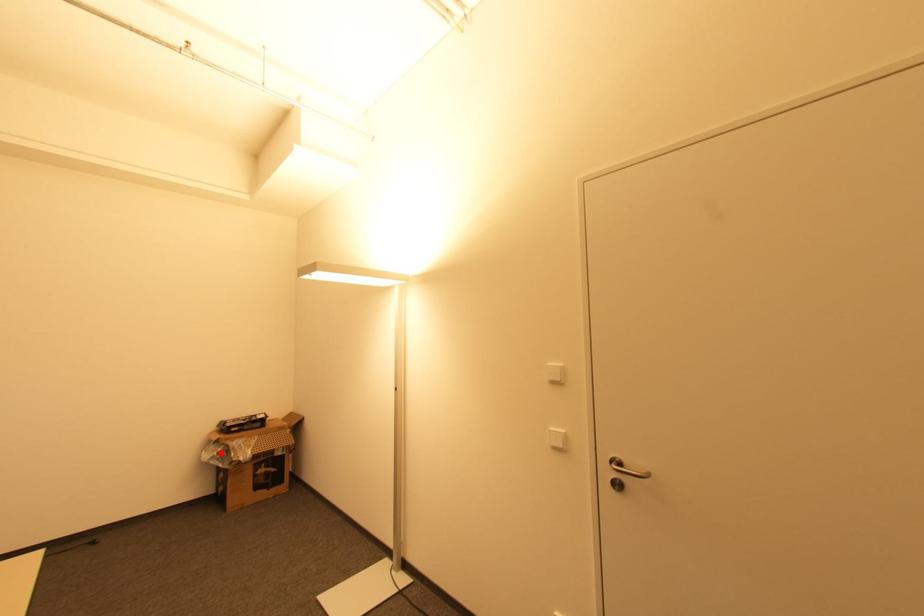
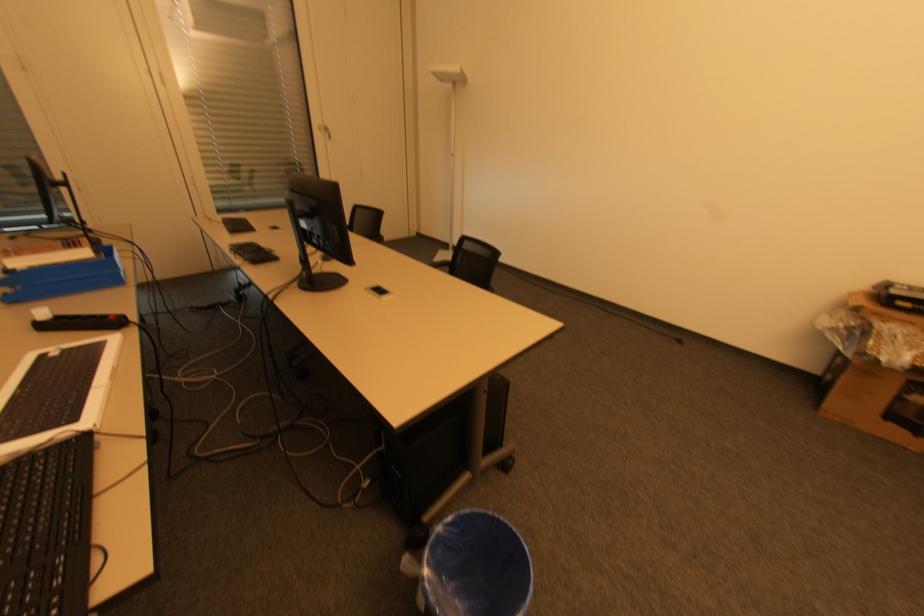
Where in the second image is the point corresponding to the highlighted location from the first image?

(850, 328)